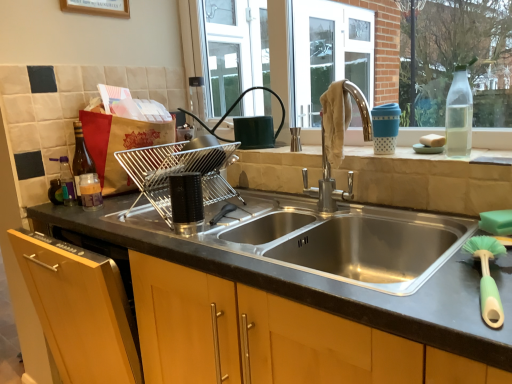
The height and width of the screenshot is (384, 512). What are the coordinates of `free location to the left of green plastic brush at lower right` in the screenshot? It's located at (402, 293).